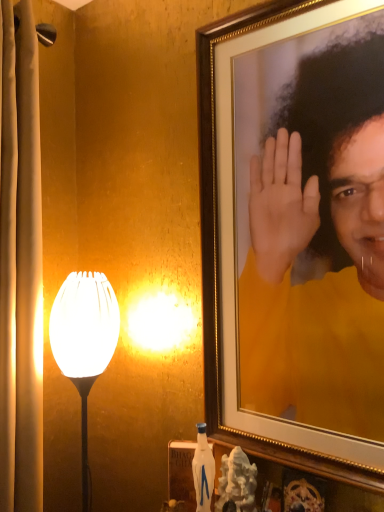
Question: From the image's perspective, is white glossy lampshade at left on top of matte yellow shirt at upper right?

Choices:
 (A) yes
 (B) no

Answer: (B)

Question: From a real-world perspective, is white glossy lampshade at left over matte yellow shirt at upper right?

Choices:
 (A) yes
 (B) no

Answer: (B)

Question: Is white glossy lampshade at left to the right of matte yellow shirt at upper right from the viewer's perspective?

Choices:
 (A) no
 (B) yes

Answer: (A)

Question: Considering the relative sizes of white glossy lampshade at left and matte yellow shirt at upper right in the image provided, is white glossy lampshade at left thinner than matte yellow shirt at upper right?

Choices:
 (A) yes
 (B) no

Answer: (B)

Question: Is white glossy lampshade at left closer to the viewer compared to matte yellow shirt at upper right?

Choices:
 (A) no
 (B) yes

Answer: (A)

Question: Can you confirm if white glossy lampshade at left is shorter than matte yellow shirt at upper right?

Choices:
 (A) yes
 (B) no

Answer: (A)

Question: Are matte yellow shirt at upper right and white glossy lampshade at left located far from each other?

Choices:
 (A) no
 (B) yes

Answer: (A)

Question: Can you confirm if matte yellow shirt at upper right is bigger than white glossy lampshade at left?

Choices:
 (A) yes
 (B) no

Answer: (A)

Question: Is matte yellow shirt at upper right facing away from white glossy lampshade at left?

Choices:
 (A) no
 (B) yes

Answer: (A)

Question: Is the position of matte yellow shirt at upper right more distant than that of white glossy lampshade at left?

Choices:
 (A) yes
 (B) no

Answer: (B)

Question: Can you confirm if matte yellow shirt at upper right is wider than white glossy lampshade at left?

Choices:
 (A) no
 (B) yes

Answer: (A)

Question: Is matte yellow shirt at upper right to the right of white glossy lampshade at left from the viewer's perspective?

Choices:
 (A) no
 (B) yes

Answer: (B)

Question: Considering the positions of white glossy lampshade at left and matte yellow shirt at upper right in the image, is white glossy lampshade at left wider or thinner than matte yellow shirt at upper right?

Choices:
 (A) thin
 (B) wide

Answer: (B)